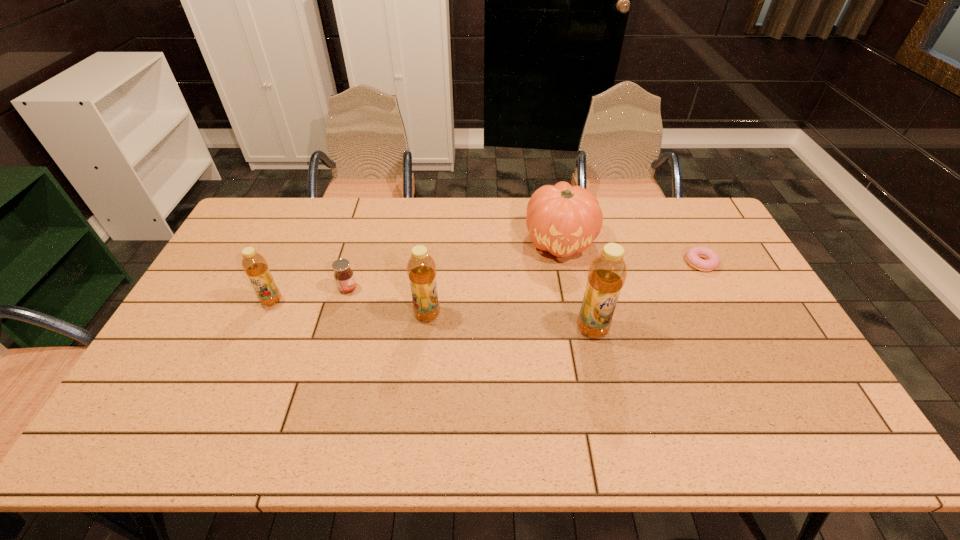
The image size is (960, 540). I want to click on the leftmost bottle, so click(x=254, y=264).

You are a GUI agent. You are given a task and a screenshot of the screen. Output one action in this format:
    pyautogui.click(x=<x>, y=<y>)
    Task: Click on the shortest bottle
    The width and height of the screenshot is (960, 540).
    Given the screenshot: What is the action you would take?
    pyautogui.click(x=254, y=264)

This screenshot has height=540, width=960. I want to click on the second bottle from left to right, so click(421, 269).

The height and width of the screenshot is (540, 960). In order to click on the third object from left to right in this screenshot , I will do [421, 269].

This screenshot has width=960, height=540. Find the location of `the rightmost bottle`. the rightmost bottle is located at coordinates (607, 273).

Find the location of a particular element. This screenshot has width=960, height=540. the tallest bottle is located at coordinates point(607,273).

Locate an element on the screen. The image size is (960, 540). pumpkin is located at coordinates (562, 219).

Locate an element on the screen. The height and width of the screenshot is (540, 960). doughnut is located at coordinates (693, 255).

You are a GUI agent. You are given a task and a screenshot of the screen. Output one action in this format:
    pyautogui.click(x=<x>, y=<y>)
    Task: Click on the rightmost object
    This screenshot has width=960, height=540.
    Given the screenshot: What is the action you would take?
    pyautogui.click(x=693, y=255)

Find the location of a particular element. jam is located at coordinates (343, 274).